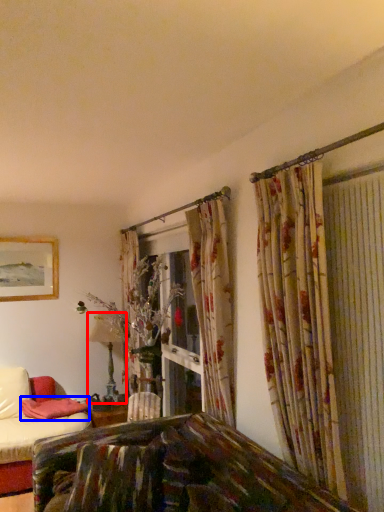
Question: Among these objects, which one is nearest to the camera, table lamp (highlighted by a red box) or pillow (highlighted by a blue box)?

Choices:
 (A) table lamp
 (B) pillow

Answer: (B)